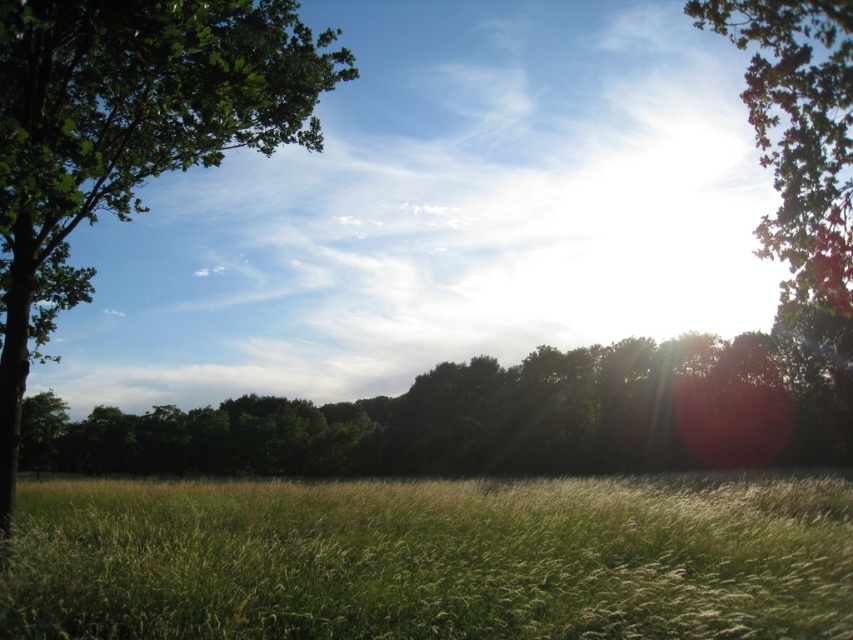
Question: Can you confirm if green leafy tree at left is positioned below green leafy tree at upper right?

Choices:
 (A) no
 (B) yes

Answer: (B)

Question: In this image, where is green leafy tree at left located relative to green leafy tree at upper right?

Choices:
 (A) left
 (B) right

Answer: (A)

Question: Which object is positioned closest to the green grass at center?

Choices:
 (A) green leafy tree at left
 (B) green leafy tree at upper right

Answer: (A)

Question: Which is nearer to the green leafy tree at upper right?

Choices:
 (A) green leafy tree at left
 (B) green grass at center

Answer: (B)

Question: Is green grass at center positioned behind green leafy tree at upper right?

Choices:
 (A) yes
 (B) no

Answer: (B)

Question: Which point appears farthest from the camera in this image?

Choices:
 (A) (288, 92)
 (B) (769, 122)
 (C) (666, 566)

Answer: (B)